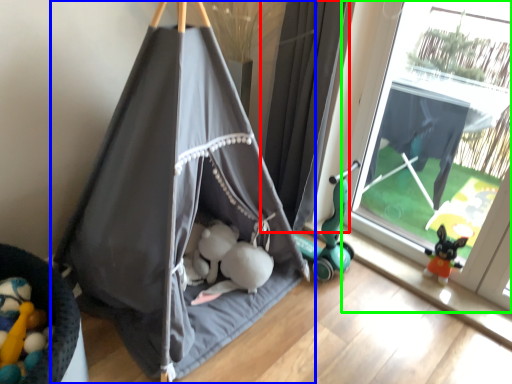
Question: Estimate the real-world distances between objects in this image. Which object is farther from curtain (highlighted by a red box), tent (highlighted by a blue box) or window (highlighted by a green box)?

Choices:
 (A) tent
 (B) window

Answer: (B)